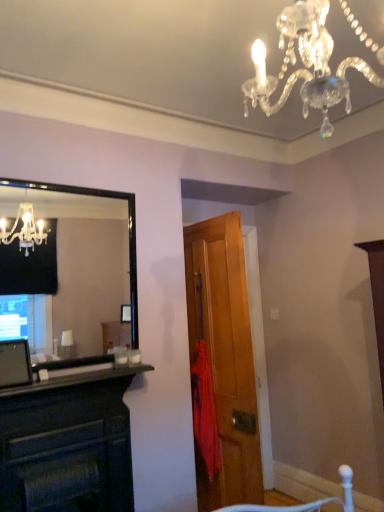
Question: Considering the positions of black glass mirror at left and black matte fireplace at lower left in the image, is black glass mirror at left bigger or smaller than black matte fireplace at lower left?

Choices:
 (A) big
 (B) small

Answer: (A)

Question: Looking at their shapes, would you say black glass mirror at left is wider or thinner than black matte fireplace at lower left?

Choices:
 (A) thin
 (B) wide

Answer: (A)

Question: Which is farther from the black glass mirror at left?

Choices:
 (A) clear crystal chandelier at upper center
 (B) red fabric umbrella at center
 (C) wooden door at center
 (D) black matte fireplace at lower left
 (E) dark wood fireplace at left

Answer: (A)

Question: Estimate the real-world distances between objects in this image. Which object is farther from the black matte fireplace at lower left?

Choices:
 (A) dark wood fireplace at left
 (B) wooden door at center
 (C) black glass mirror at left
 (D) red fabric umbrella at center
 (E) clear crystal chandelier at upper center

Answer: (C)